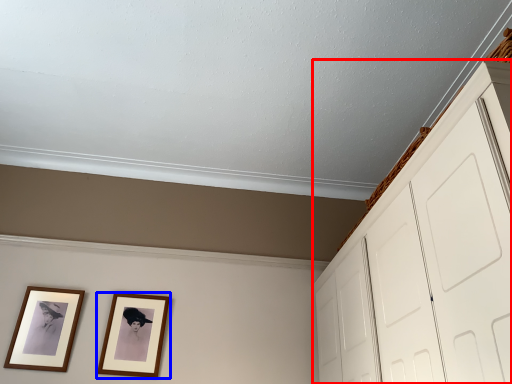
Question: Which point is further to the camera, dresser (highlighted by a red box) or picture frame (highlighted by a blue box)?

Choices:
 (A) dresser
 (B) picture frame

Answer: (B)